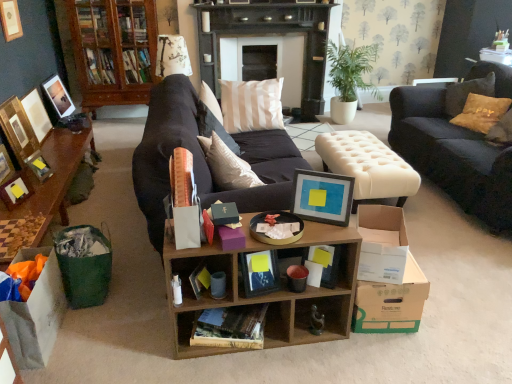
Question: Is green leafy plant at center outside of wooden cabinet at upper left?

Choices:
 (A) yes
 (B) no

Answer: (A)

Question: Does green leafy plant at center have a lesser width compared to wooden cabinet at upper left?

Choices:
 (A) no
 (B) yes

Answer: (A)

Question: From a real-world perspective, does green leafy plant at center stand above wooden cabinet at upper left?

Choices:
 (A) no
 (B) yes

Answer: (A)

Question: Does green leafy plant at center appear on the right side of wooden cabinet at upper left?

Choices:
 (A) yes
 (B) no

Answer: (A)

Question: Is green leafy plant at center to the left of wooden cabinet at upper left from the viewer's perspective?

Choices:
 (A) no
 (B) yes

Answer: (A)

Question: Is matte black picture frame at left, the second picture frame positioned from the right, taller or shorter than matte white picture frame at left, marked as the fifth picture frame in a right-to-left arrangement?

Choices:
 (A) short
 (B) tall

Answer: (A)

Question: Based on their sizes in the image, would you say matte black picture frame at left, the second picture frame positioned from the right, is bigger or smaller than matte white picture frame at left, the 4th picture frame when ordered from left to right?

Choices:
 (A) small
 (B) big

Answer: (A)

Question: Is matte black picture frame at left, the second picture frame positioned from the right, wider or thinner than matte white picture frame at left, the 4th picture frame when ordered from left to right?

Choices:
 (A) wide
 (B) thin

Answer: (B)

Question: From the image's perspective, is matte black picture frame at left, marked as the 7th picture frame in a left-to-right arrangement, positioned above or below matte white picture frame at left, marked as the fifth picture frame in a right-to-left arrangement?

Choices:
 (A) below
 (B) above

Answer: (A)

Question: From the image's perspective, relative to brown cardboard book at center, marked as the second book in a top-to-bottom arrangement, is cream tufted ottoman at center above or below?

Choices:
 (A) above
 (B) below

Answer: (A)

Question: From a real-world perspective, is cream tufted ottoman at center physically located above or below brown cardboard book at center, the first book in the bottom-to-top sequence?

Choices:
 (A) below
 (B) above

Answer: (B)

Question: Visually, is cream tufted ottoman at center positioned to the left or to the right of brown cardboard book at center, marked as the second book in a top-to-bottom arrangement?

Choices:
 (A) left
 (B) right

Answer: (B)

Question: Considering their positions, is cream tufted ottoman at center located in front of or behind brown cardboard book at center, the first book in the bottom-to-top sequence?

Choices:
 (A) behind
 (B) front

Answer: (A)

Question: From a real-world perspective, relative to cardboard box at lower right, which ranks as the first cardboard box in right-to-left order, is matte white picture frame at left, the 4th picture frame when ordered from left to right, vertically above or below?

Choices:
 (A) above
 (B) below

Answer: (A)

Question: Choose the correct answer: Is matte white picture frame at left, marked as the fifth picture frame in a right-to-left arrangement, inside cardboard box at lower right, which ranks as the first cardboard box in right-to-left order, or outside it?

Choices:
 (A) inside
 (B) outside

Answer: (B)